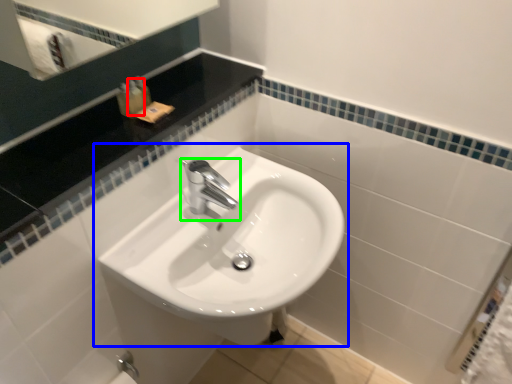
Question: Which object is the farthest from toiletry (highlighted by a red box)? Choose among these: sink (highlighted by a blue box) or tap (highlighted by a green box).

Choices:
 (A) sink
 (B) tap

Answer: (A)